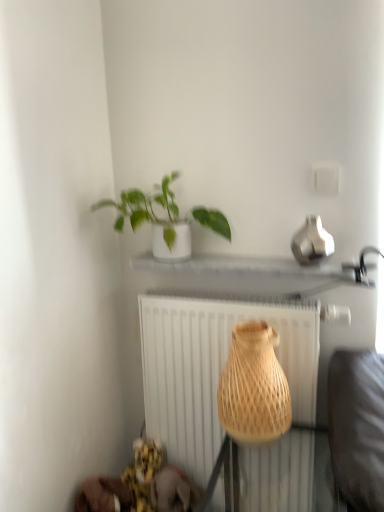
Question: Can you confirm if natural woven vase at center is smaller than green matte plant at upper center?

Choices:
 (A) no
 (B) yes

Answer: (B)

Question: From the image's perspective, is natural woven vase at center on top of green matte plant at upper center?

Choices:
 (A) yes
 (B) no

Answer: (B)

Question: Is natural woven vase at center positioned before green matte plant at upper center?

Choices:
 (A) no
 (B) yes

Answer: (B)

Question: Does natural woven vase at center come behind green matte plant at upper center?

Choices:
 (A) no
 (B) yes

Answer: (A)

Question: Can you confirm if natural woven vase at center is thinner than green matte plant at upper center?

Choices:
 (A) no
 (B) yes

Answer: (A)

Question: Is natural woven vase at center far away from green matte plant at upper center?

Choices:
 (A) no
 (B) yes

Answer: (A)

Question: Is white textured radiator at center completely or partially outside of natural woven vase at center?

Choices:
 (A) yes
 (B) no

Answer: (A)

Question: Is natural woven vase at center at the back of white textured radiator at center?

Choices:
 (A) yes
 (B) no

Answer: (A)

Question: Is white textured radiator at center positioned far away from natural woven vase at center?

Choices:
 (A) no
 (B) yes

Answer: (A)

Question: Would you say white textured radiator at center contains natural woven vase at center?

Choices:
 (A) no
 (B) yes

Answer: (A)

Question: Is white textured radiator at center closer to the viewer compared to natural woven vase at center?

Choices:
 (A) no
 (B) yes

Answer: (A)

Question: Does white textured radiator at center have a lesser height compared to natural woven vase at center?

Choices:
 (A) yes
 (B) no

Answer: (B)

Question: Is green matte plant at upper center behind white textured radiator at center?

Choices:
 (A) yes
 (B) no

Answer: (B)